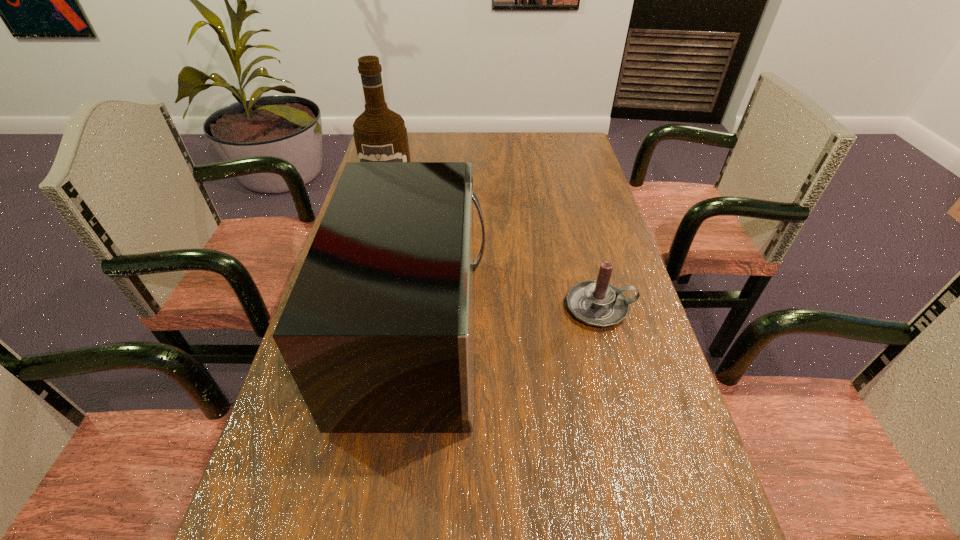
Image resolution: width=960 pixels, height=540 pixels. I want to click on the farthest object, so click(x=380, y=135).

The width and height of the screenshot is (960, 540). Find the location of `the tallest object`. the tallest object is located at coordinates point(380,135).

The width and height of the screenshot is (960, 540). In order to click on microwave oven in this screenshot , I will do `click(378, 332)`.

You are a GUI agent. You are given a task and a screenshot of the screen. Output one action in this format:
    pyautogui.click(x=<x>, y=<y>)
    Task: Click on the rightmost object
    The image size is (960, 540).
    Given the screenshot: What is the action you would take?
    pyautogui.click(x=597, y=303)

Locate an element on the screen. This screenshot has width=960, height=540. the shortest object is located at coordinates (597, 303).

Identify the location of vacant space located on the label of the farthest object. [x=374, y=246].

This screenshot has width=960, height=540. What are the coordinates of `blank area located 0.110m with the door open on the second tallest object` in the screenshot? It's located at (535, 334).

Identify the location of alcohol situated at the left edge. The height and width of the screenshot is (540, 960). (380, 135).

Identify the location of microwave oven at the left edge. The width and height of the screenshot is (960, 540). (378, 332).

Image resolution: width=960 pixels, height=540 pixels. I want to click on object that is at the right edge, so click(597, 303).